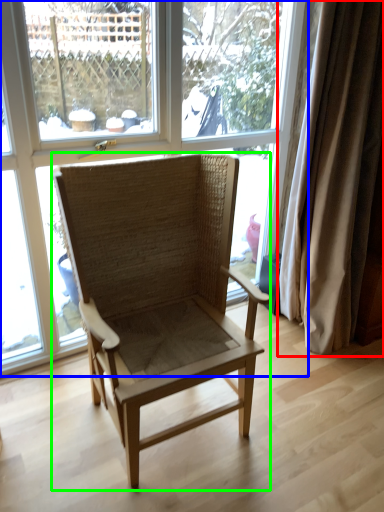
Question: Based on their relative distances, which object is farther from curtain (highlighted by a red box)? Choose from window (highlighted by a blue box) and chair (highlighted by a green box).

Choices:
 (A) window
 (B) chair

Answer: (A)